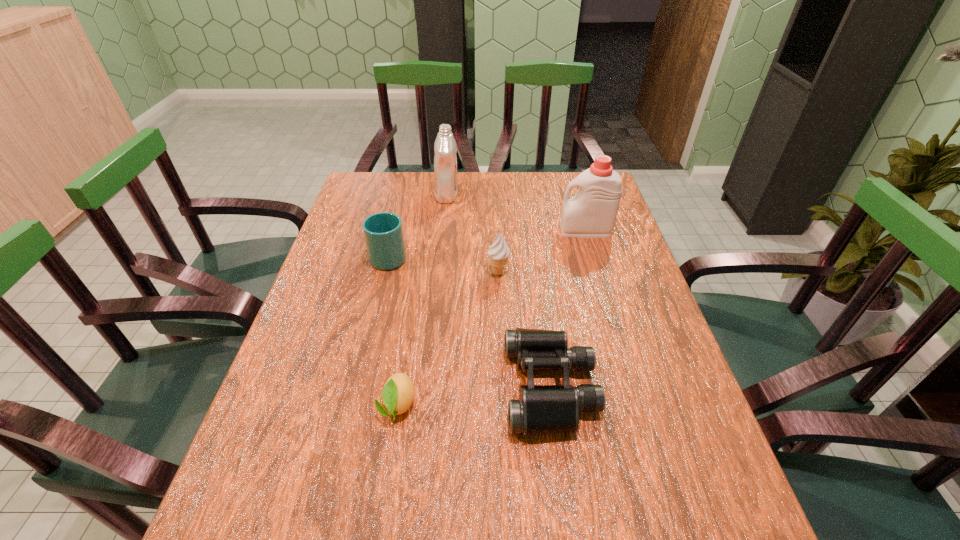
You are a GUI agent. You are given a task and a screenshot of the screen. Output one action in this format:
    pyautogui.click(x=<x>, y=<y>)
    Task: Click on the free space that satisfies the following two spatial constraints: 1. on the front-facing side of the icecream; 2. with leaves positioned above the lemon
    The image size is (960, 540).
    Given the screenshot: What is the action you would take?
    pyautogui.click(x=504, y=405)

In order to click on free space that satisfies the following two spatial constraints: 1. on the front-facing side of the fifth tallest object; 2. with leaves positioned above the lemon in this screenshot , I will do `click(553, 405)`.

Identify the location of free space in the image that satisfies the following two spatial constraints: 1. on the handle side of the farthest object; 2. on the right side of the leftmost object. The height and width of the screenshot is (540, 960). (404, 195).

I want to click on vacant space that satisfies the following two spatial constraints: 1. on the front-facing side of the second shortest object; 2. with leaves positioned above the shortest object, so click(x=553, y=405).